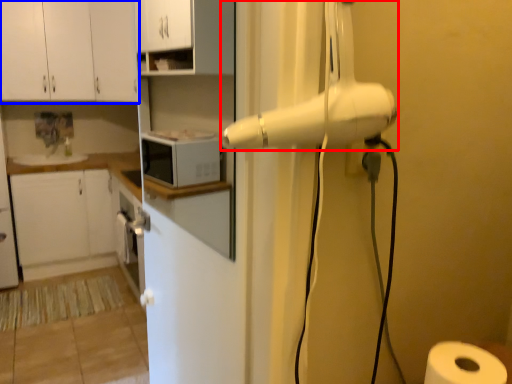
Question: Among these objects, which one is nearest to the camera, home appliance (highlighted by a red box) or cabinetry (highlighted by a blue box)?

Choices:
 (A) home appliance
 (B) cabinetry

Answer: (A)